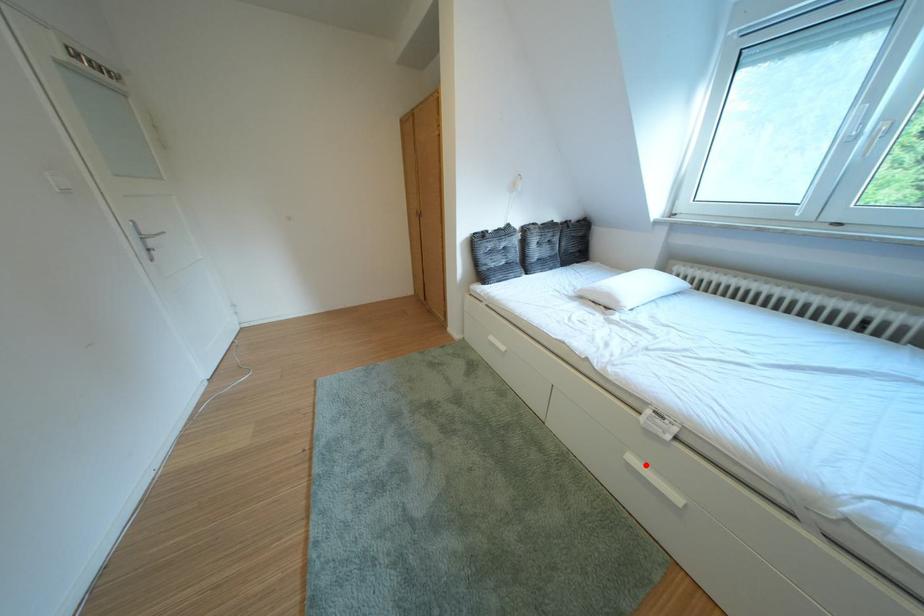
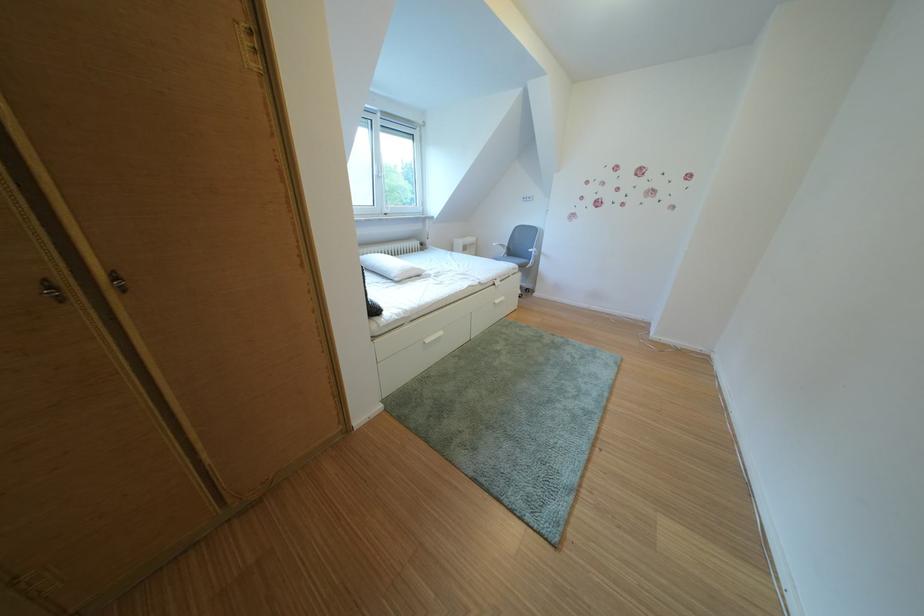
Where in the second image is the point corresponding to the highlighted location from the first image?

(511, 307)